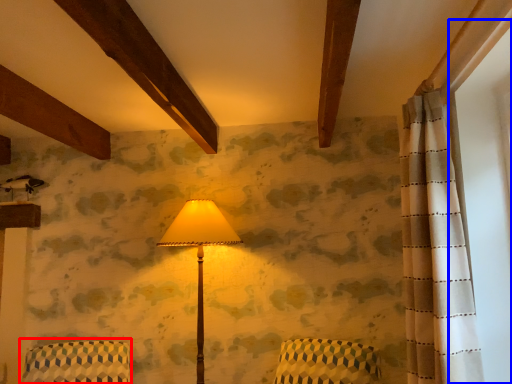
Question: Which object appears farthest to the camera in this image, armchair (highlighted by a red box) or window screen (highlighted by a blue box)?

Choices:
 (A) armchair
 (B) window screen

Answer: (A)